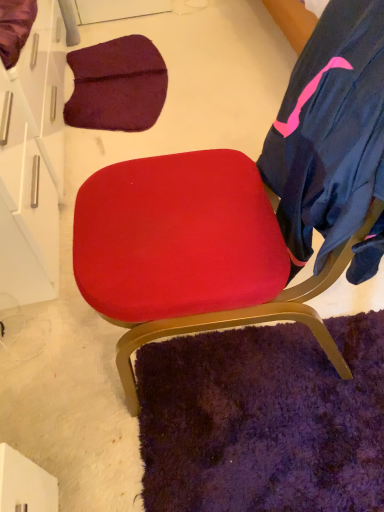
Question: Is white glossy drawer at upper left taller than dark blue fabric robe at right?

Choices:
 (A) yes
 (B) no

Answer: (B)

Question: Is white glossy drawer at upper left positioned beyond the bounds of dark blue fabric robe at right?

Choices:
 (A) no
 (B) yes

Answer: (B)

Question: Is white glossy drawer at upper left aimed at dark blue fabric robe at right?

Choices:
 (A) no
 (B) yes

Answer: (A)

Question: From the image's perspective, would you say white glossy drawer at upper left is positioned over dark blue fabric robe at right?

Choices:
 (A) no
 (B) yes

Answer: (B)

Question: Can you confirm if white glossy drawer at upper left is positioned to the right of dark blue fabric robe at right?

Choices:
 (A) no
 (B) yes

Answer: (A)

Question: Is dark blue fabric robe at right situated inside white glossy drawer at upper left or outside?

Choices:
 (A) inside
 (B) outside

Answer: (B)

Question: Is dark blue fabric robe at right bigger or smaller than white glossy drawer at upper left?

Choices:
 (A) big
 (B) small

Answer: (B)

Question: Considering their positions, is dark blue fabric robe at right located in front of or behind white glossy drawer at upper left?

Choices:
 (A) behind
 (B) front

Answer: (B)

Question: Is dark blue fabric robe at right to the left or to the right of white glossy drawer at upper left in the image?

Choices:
 (A) left
 (B) right

Answer: (B)

Question: Is point (150, 247) closer or farther from the camera than point (360, 199)?

Choices:
 (A) closer
 (B) farther

Answer: (B)

Question: Considering the relative positions of suede red chair at center and dark blue fabric robe at right in the image provided, is suede red chair at center to the left or to the right of dark blue fabric robe at right?

Choices:
 (A) left
 (B) right

Answer: (A)

Question: Which is correct: suede red chair at center is inside dark blue fabric robe at right, or outside of it?

Choices:
 (A) inside
 (B) outside

Answer: (A)

Question: From a real-world perspective, is suede red chair at center above or below dark blue fabric robe at right?

Choices:
 (A) above
 (B) below

Answer: (B)

Question: Considering the positions of suede red chair at center and white glossy drawer at upper left in the image, is suede red chair at center bigger or smaller than white glossy drawer at upper left?

Choices:
 (A) small
 (B) big

Answer: (B)

Question: In terms of width, does suede red chair at center look wider or thinner when compared to white glossy drawer at upper left?

Choices:
 (A) wide
 (B) thin

Answer: (A)